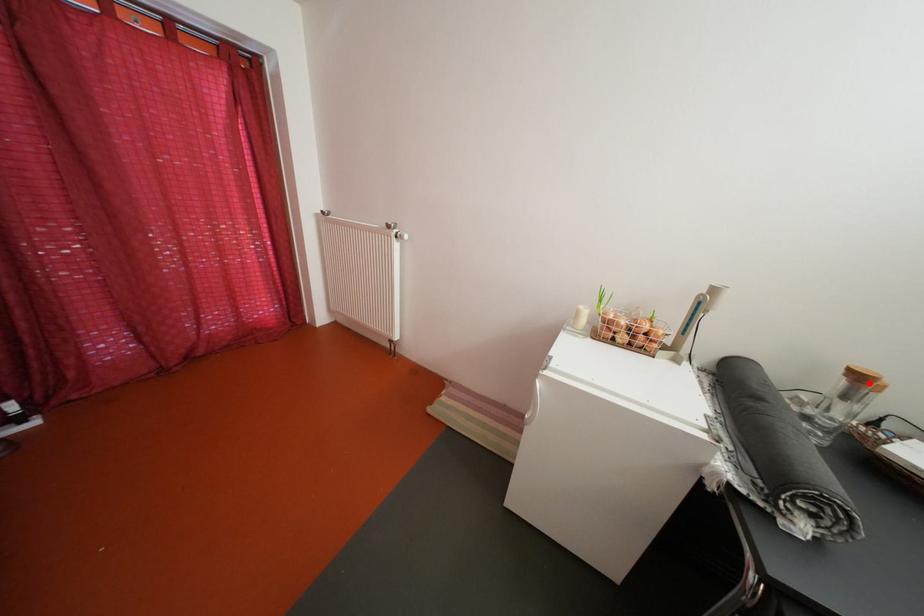
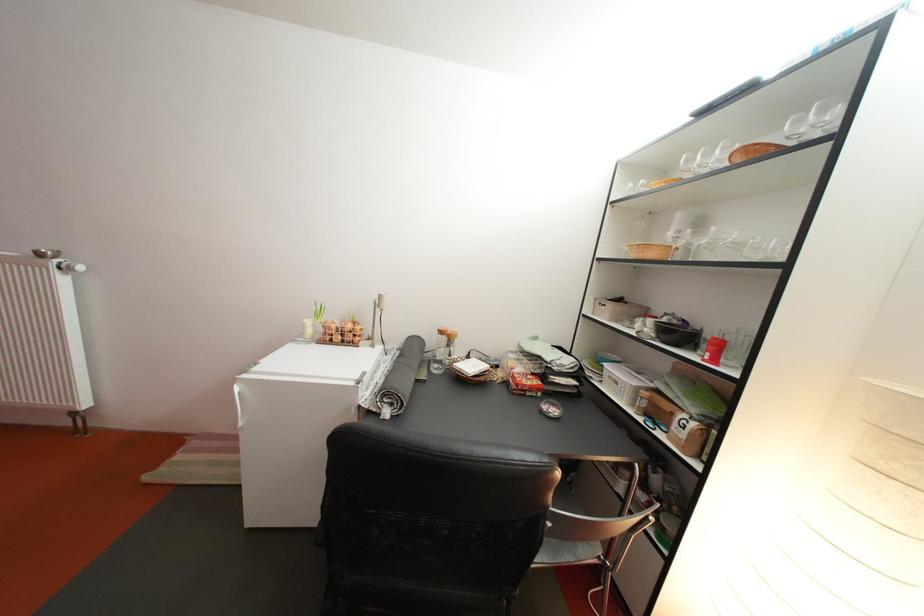
Locate, in the second image, the point that corresponds to the highlighted location in the first image.

(453, 339)